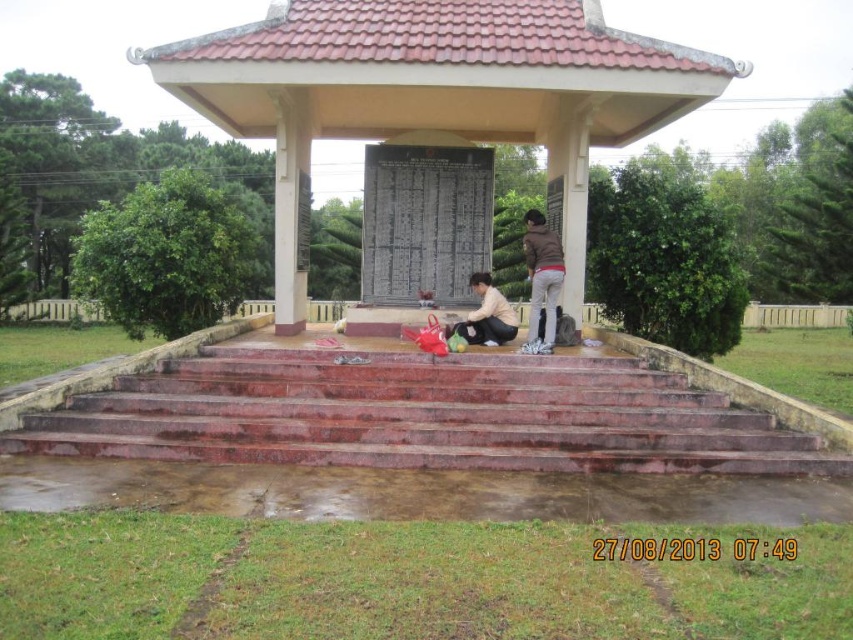
Does brown leather jacket at center appear on the left side of matte black bag at center?

In fact, brown leather jacket at center is to the right of matte black bag at center.

Who is higher up, brown leather jacket at center or matte black bag at center?

brown leather jacket at center is higher up.

Does point (550, 268) come behind point (494, 300)?

No.

Locate an element on the screen. Image resolution: width=853 pixels, height=640 pixels. brown leather jacket at center is located at coordinates (541, 280).

Which is below, marble stairs at center or brown leather jacket at center?

marble stairs at center is below.

Is point (640, 420) farther from camera compared to point (560, 253)?

No, it is not.

Identify the location of marble stairs at center. The image size is (853, 640). (422, 416).

Who is higher up, marble stairs at center or matte black bag at center?

matte black bag at center is higher up.

Is point (712, 426) farther from viewer compared to point (448, 326)?

That is False.

At what (x,y) coordinates should I click in order to perform the action: click on marble stairs at center. Please return your answer as a coordinate pair (x, y). The image size is (853, 640). Looking at the image, I should click on (422, 416).